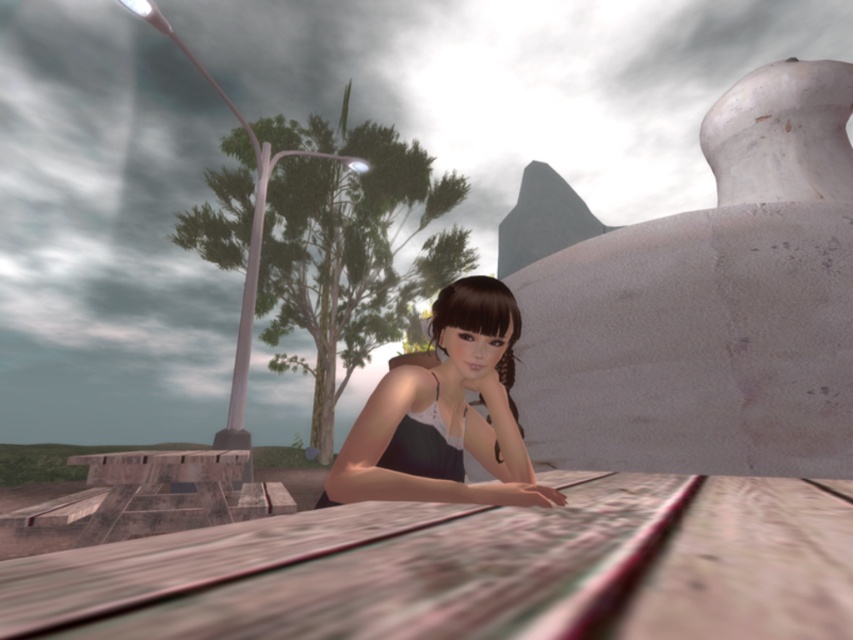
Question: Does wooden picnic table at center appear on the left side of matte black dress at center?

Choices:
 (A) no
 (B) yes

Answer: (A)

Question: Among these objects, which one is nearest to the camera?

Choices:
 (A) matte black dress at center
 (B) wooden picnic table at center

Answer: (B)

Question: Which of the following is the closest to the observer?

Choices:
 (A) (500, 307)
 (B) (450, 625)

Answer: (B)

Question: Is wooden picnic table at center positioned at the back of matte black dress at center?

Choices:
 (A) no
 (B) yes

Answer: (A)

Question: Can you confirm if wooden picnic table at center is positioned above matte black dress at center?

Choices:
 (A) yes
 (B) no

Answer: (A)

Question: Which of the following is the closest to the observer?

Choices:
 (A) (433, 628)
 (B) (491, 301)

Answer: (A)